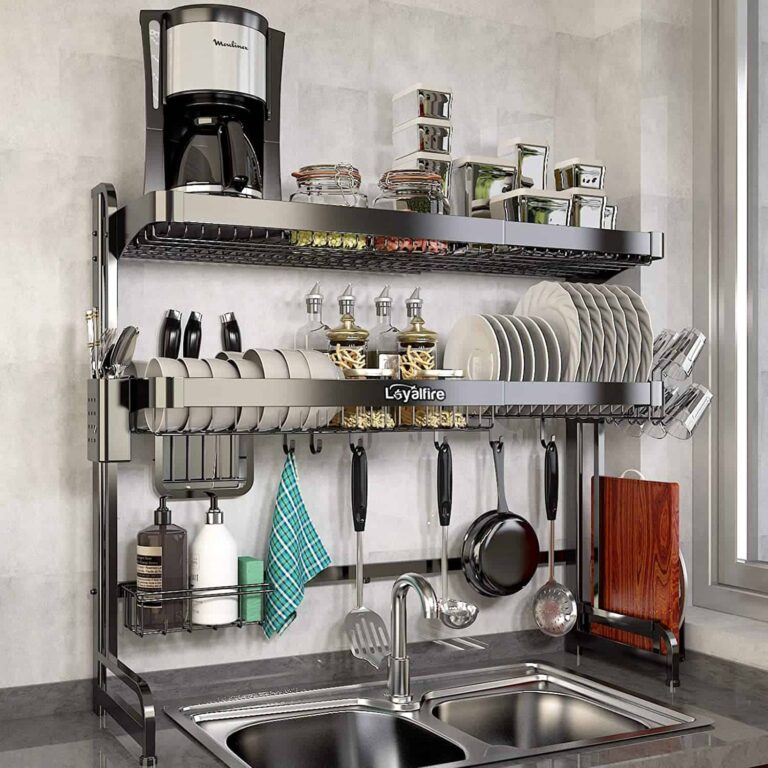
Identify the location of hook. (544, 442), (494, 447), (439, 445), (356, 444), (315, 445), (288, 447).